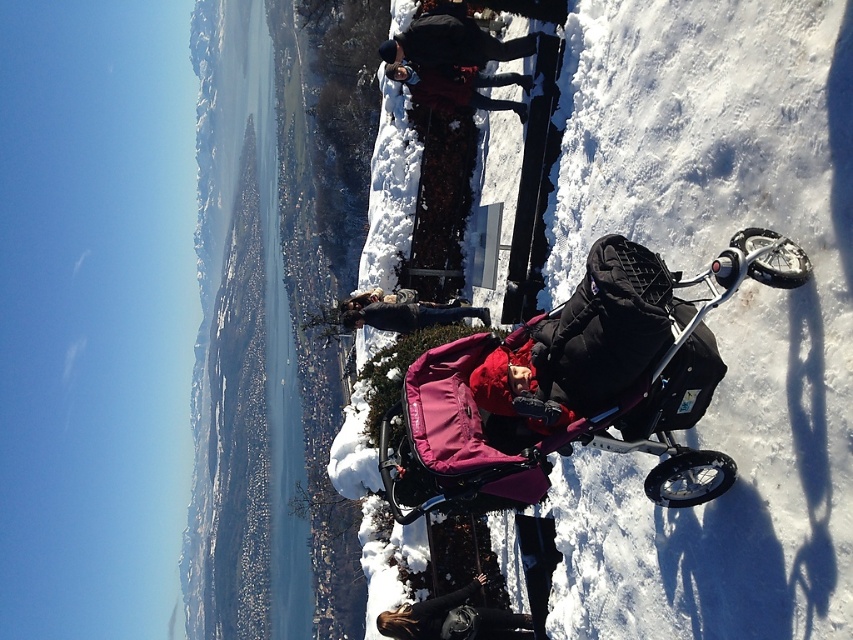
Question: Observing the image, what is the correct spatial positioning of purple fabric stroller at center in reference to matte black jacket at center?

Choices:
 (A) right
 (B) left

Answer: (A)

Question: Does black leather jacket at lower center appear on the right side of dark blue jacket at upper center?

Choices:
 (A) no
 (B) yes

Answer: (B)

Question: Which object is closer to the camera taking this photo?

Choices:
 (A) dark blue jacket at upper center
 (B) black leather jacket at lower center

Answer: (B)

Question: Does dark blue jacket at upper center appear on the left side of matte black jacket at center?

Choices:
 (A) no
 (B) yes

Answer: (B)

Question: Among these objects, which one is farthest from the camera?

Choices:
 (A) matte black jacket at center
 (B) black leather jacket at lower center
 (C) purple fabric stroller at center

Answer: (A)

Question: Which object is the farthest from the black leather jacket at lower center?

Choices:
 (A) dark blue jacket at upper center
 (B) matte black jacket at center
 (C) purple fabric stroller at center

Answer: (C)